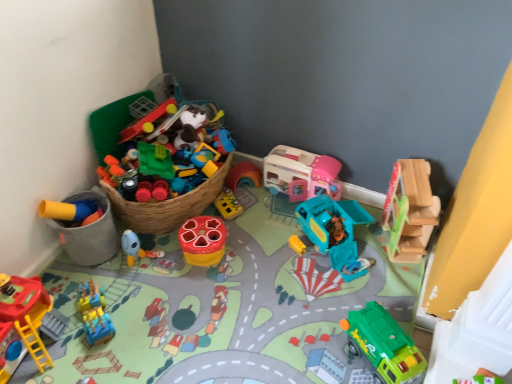
Image resolution: width=512 pixels, height=384 pixels. In order to click on vacant area that lies to the right of rubberized yellow toy at left, which appears as the 8th toy when viewed from the right in this screenshot , I will do `click(146, 257)`.